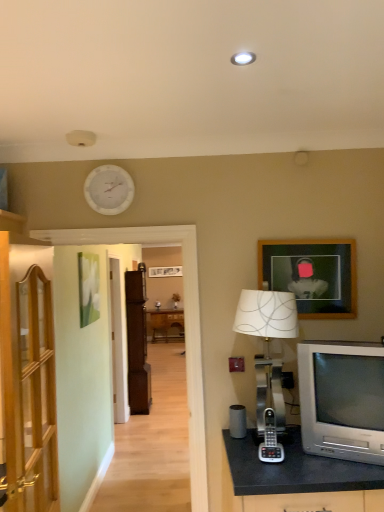
Question: Is wooden cabinet at left, which appears as the 2th cabinetry when viewed from the back, taller than silver metallic phone at center?

Choices:
 (A) no
 (B) yes

Answer: (B)

Question: From the image's perspective, is wooden cabinet at left, positioned as the 1th cabinetry in front-to-back order, below silver metallic phone at center?

Choices:
 (A) no
 (B) yes

Answer: (A)

Question: Is wooden cabinet at left, which appears as the 2th cabinetry when viewed from the back, shorter than silver metallic phone at center?

Choices:
 (A) no
 (B) yes

Answer: (A)

Question: From a real-world perspective, is wooden cabinet at left, which appears as the 2th cabinetry when viewed from the back, positioned under silver metallic phone at center based on gravity?

Choices:
 (A) yes
 (B) no

Answer: (B)

Question: Can you confirm if wooden cabinet at left, which appears as the 2th cabinetry when viewed from the back, is bigger than silver metallic phone at center?

Choices:
 (A) yes
 (B) no

Answer: (A)

Question: Can silver metallic phone at center be found inside wooden cabinet at left, which appears as the 2th cabinetry when viewed from the back?

Choices:
 (A) no
 (B) yes

Answer: (A)

Question: Does silver metallic phone at center appear on the left side of wooden picture frame at upper right?

Choices:
 (A) yes
 (B) no

Answer: (A)

Question: Can you confirm if silver metallic phone at center is thinner than wooden picture frame at upper right?

Choices:
 (A) yes
 (B) no

Answer: (B)

Question: From a real-world perspective, is silver metallic phone at center positioned under wooden picture frame at upper right based on gravity?

Choices:
 (A) yes
 (B) no

Answer: (A)

Question: Can you confirm if silver metallic phone at center is wider than wooden picture frame at upper right?

Choices:
 (A) no
 (B) yes

Answer: (B)

Question: Is silver metallic phone at center bigger than wooden picture frame at upper right?

Choices:
 (A) no
 (B) yes

Answer: (A)

Question: Is silver metallic phone at center at the right side of wooden picture frame at upper right?

Choices:
 (A) no
 (B) yes

Answer: (A)

Question: Is silver metallic phone at center taller than silver metallic table lamp at right?

Choices:
 (A) no
 (B) yes

Answer: (A)